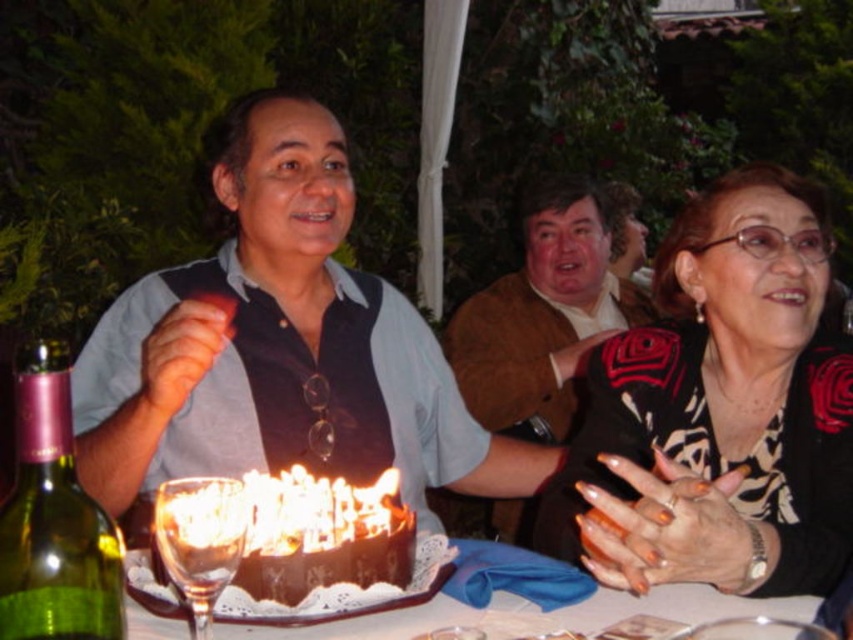
Question: Which object appears farthest from the camera in this image?

Choices:
 (A) brown fuzzy sweater at upper center
 (B) white lace doily at center
 (C) chocolate cake at center

Answer: (A)

Question: Is chocolate cake at center to the left of transparent glass at center from the viewer's perspective?

Choices:
 (A) yes
 (B) no

Answer: (B)

Question: Is matte brown vest at center to the right of transparent glass at center from the viewer's perspective?

Choices:
 (A) yes
 (B) no

Answer: (A)

Question: Based on their relative distances, which object is farther from the transparent glass at center?

Choices:
 (A) brown fuzzy sweater at upper center
 (B) black printed blouse at center

Answer: (A)

Question: Is matte brown vest at center bigger than black printed blouse at center?

Choices:
 (A) yes
 (B) no

Answer: (A)

Question: Which object is positioned closest to the black printed blouse at center?

Choices:
 (A) green glass bottle at lower left
 (B) brown fuzzy sweater at upper center
 (C) transparent glass at center

Answer: (C)